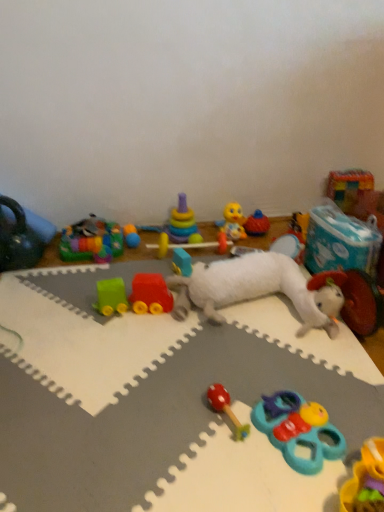
This screenshot has height=512, width=384. Identify the location of vacant space in between rubber ball at center, which appears as the 3th toy when viewed from the left, and stacked plastic rings at center, which is the 12th toy from right to left. (155, 241).